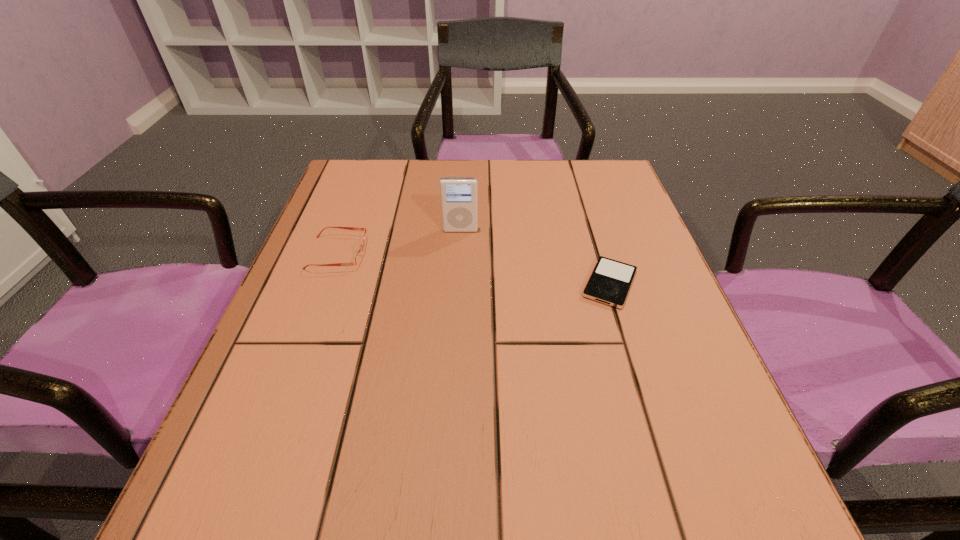
Where is `vacant space that's between the rightmost object and the leftmost object`? This screenshot has height=540, width=960. vacant space that's between the rightmost object and the leftmost object is located at coordinates (x=474, y=268).

Find the location of a particular element. The height and width of the screenshot is (540, 960). empty space between the nearer iPod and the farther iPod is located at coordinates tap(535, 257).

Find the location of a particular element. vacant space that is in between the spectacles and the shortest object is located at coordinates (474, 268).

The height and width of the screenshot is (540, 960). In order to click on unoccupied area between the tallest object and the shortest object in this screenshot , I will do `click(535, 257)`.

Where is `free area in between the right iPod and the farthest object`? Image resolution: width=960 pixels, height=540 pixels. free area in between the right iPod and the farthest object is located at coordinates (535, 257).

Where is `unoccupied position between the right iPod and the left iPod`? The image size is (960, 540). unoccupied position between the right iPod and the left iPod is located at coordinates (535, 257).

Locate an element on the screen. This screenshot has height=540, width=960. vacant area between the spectacles and the shortest object is located at coordinates (474, 268).

What are the coordinates of `vacant space in between the taller iPod and the shortest object` in the screenshot? It's located at (535, 257).

The width and height of the screenshot is (960, 540). Find the location of `object that is the nearest to the second object from left to right`. object that is the nearest to the second object from left to right is located at coordinates (358, 258).

Where is `object that is the second closest to the spectacles`? The image size is (960, 540). object that is the second closest to the spectacles is located at coordinates pos(610,281).